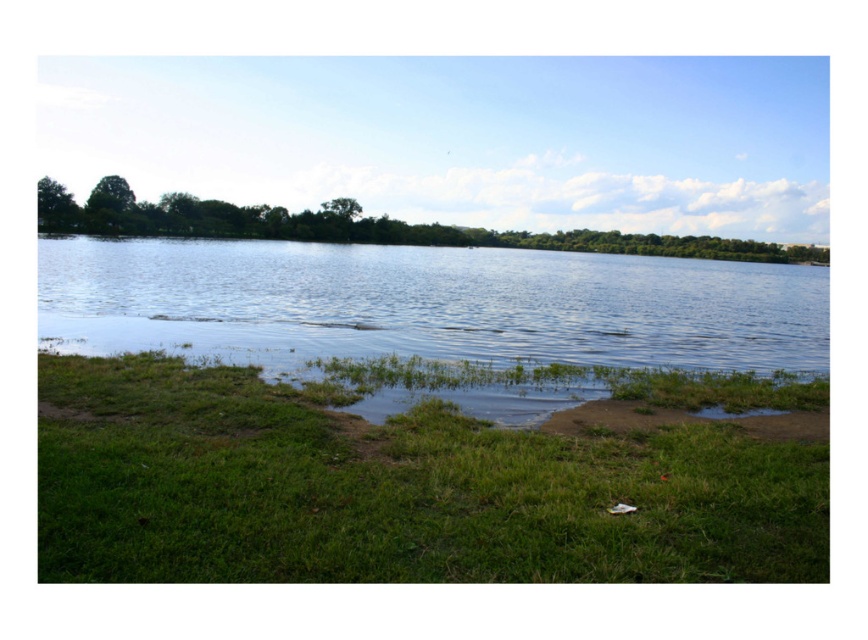
Which is below, green grassy at lower left or clear water at center?

Positioned lower is green grassy at lower left.

From the picture: Does green grassy at lower left appear on the left side of clear water at center?

No, green grassy at lower left is not to the left of clear water at center.

Describe the element at coordinates (393, 490) in the screenshot. This screenshot has height=640, width=868. I see `green grassy at lower left` at that location.

I want to click on green grassy at lower left, so click(x=393, y=490).